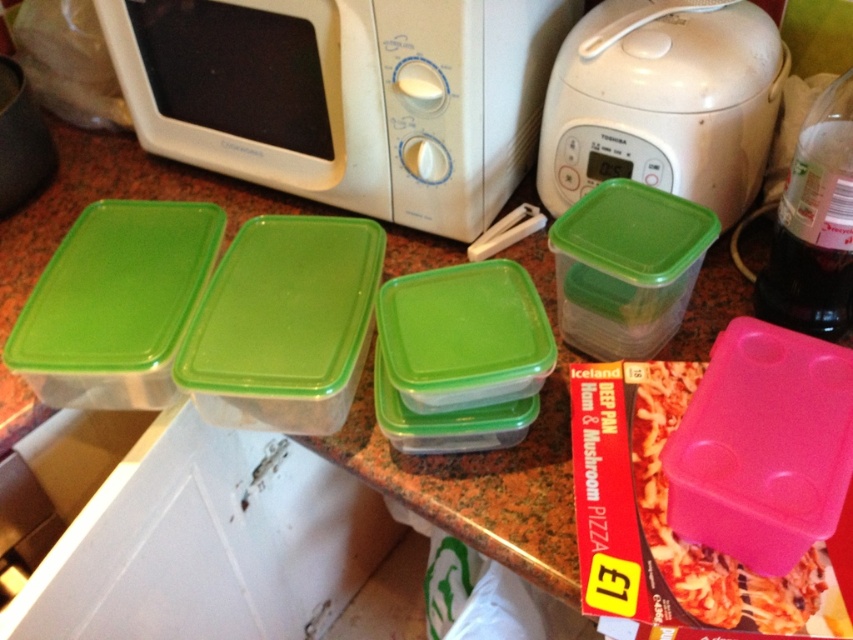
You are trying to place a 60 cm wide cutting board between the white plastic microwave at upper left and the white rice cooker at lower right. Will it fit?

The distance between the white plastic microwave at upper left and the white rice cooker at lower right is 66.15 centimeters. Since the cutting board is 60 cm wide, it will fit with about 6.15 cm of space remaining.

You are organizing the kitchen countertop and need to place the white plastic microwave at upper left and the pink plastic container at lower right. Based on their positions, which object is closer to the edge of the countertop?

The pink plastic container at lower right is closer to the edge of the countertop since it is positioned lower than the white plastic microwave at upper left, which is above it.

You are organizing the kitchen countertop and need to place a new spice jar between the white plastic rice cooker at upper center and the pink plastic container at lower right. Based on their current positions, where should you place the spice jar?

The white plastic rice cooker at upper center is to the right of the pink plastic container at lower right. Therefore, to place the spice jar between them, you should position it to the left of the white plastic rice cooker at upper center and to the right of the pink plastic container at lower right.